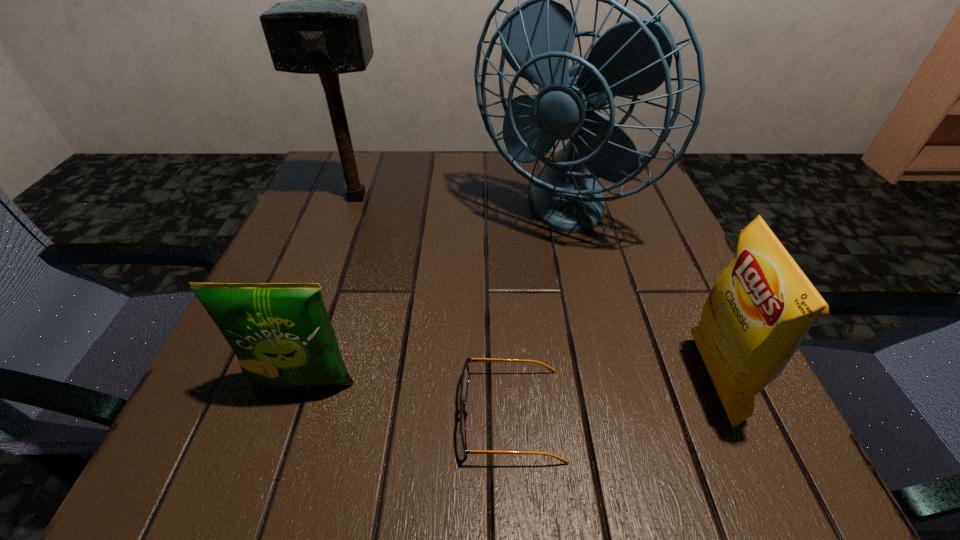
Where is `free area in between the mallet and the fourth tallest object`? The width and height of the screenshot is (960, 540). free area in between the mallet and the fourth tallest object is located at coordinates (330, 291).

Find the location of a particular element. empty location between the right crisp (potato chip) and the spectacles is located at coordinates (612, 397).

Locate an element on the screen. This screenshot has width=960, height=540. the third closest object to the shortest object is located at coordinates (633, 57).

Identify which object is the second nearest to the fourth tallest object. Please provide its 2D coordinates. Your answer should be formatted as a tuple, i.e. [(x, y)], where the tuple contains the x and y coordinates of a point satisfying the conditions above.

[(633, 57)]

The height and width of the screenshot is (540, 960). In order to click on free space that satisfies the following two spatial constraints: 1. on the front of the right crisp (potato chip) with the logo; 2. on the front-facing side of the second shortest object in this screenshot , I will do [x=713, y=384].

Find the location of a particular element. Image resolution: width=960 pixels, height=540 pixels. free location that satisfies the following two spatial constraints: 1. on the front of the right crisp (potato chip) with the logo; 2. on the front-facing side of the left crisp (potato chip) is located at coordinates (713, 384).